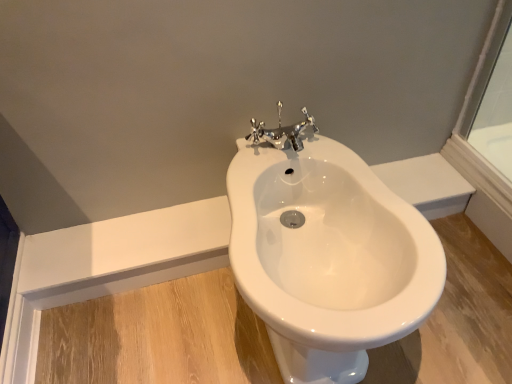
Measure the distance between point (351, 157) and camera.

Point (351, 157) and camera are 37.64 inches apart.

The height and width of the screenshot is (384, 512). What do you see at coordinates (326, 253) in the screenshot?
I see `white glossy bidet at center` at bounding box center [326, 253].

Identify the location of white glossy bidet at center. (326, 253).

Find the location of a particular element. white glossy bidet at center is located at coordinates [x=326, y=253].